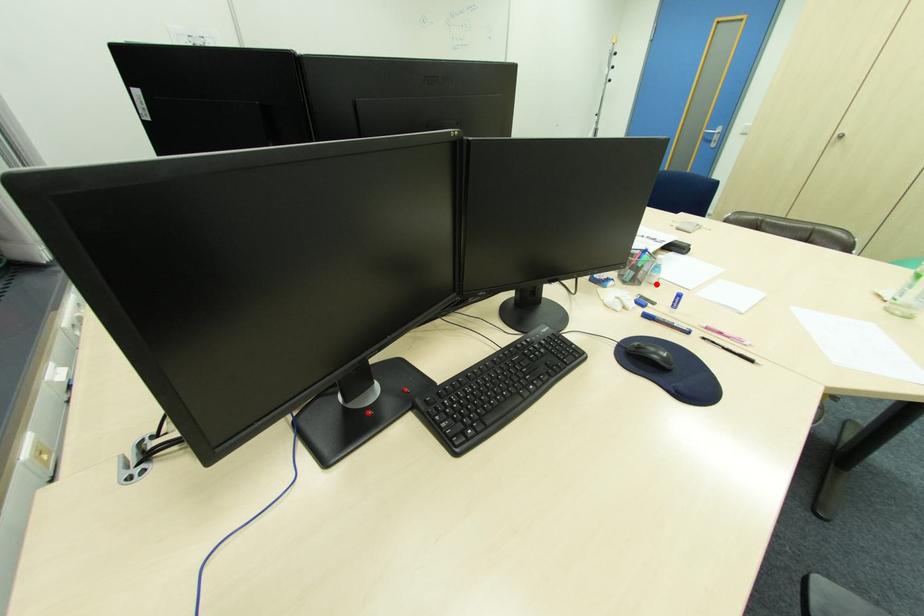
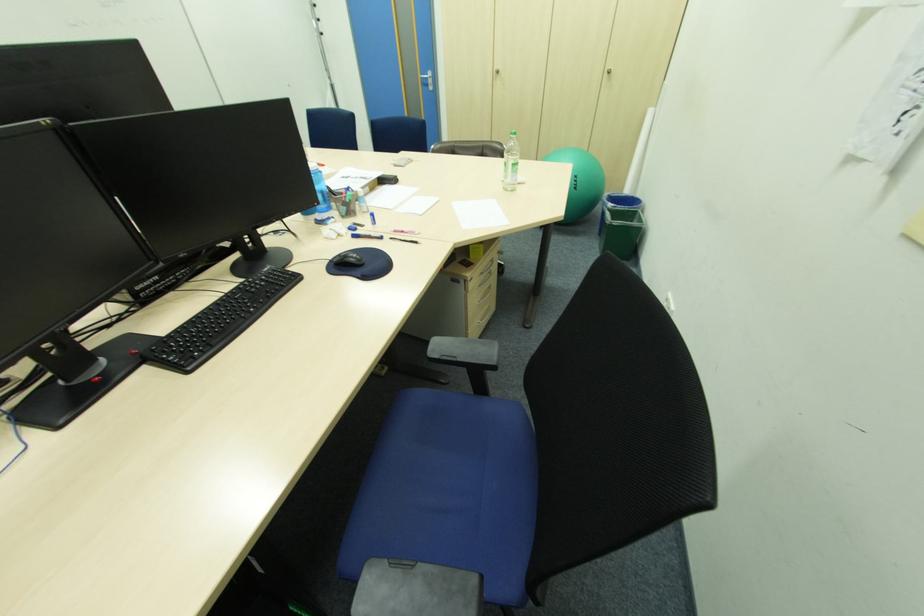
The point at the highlighted location is marked in the first image. Where is the corresponding point in the second image?

(370, 213)